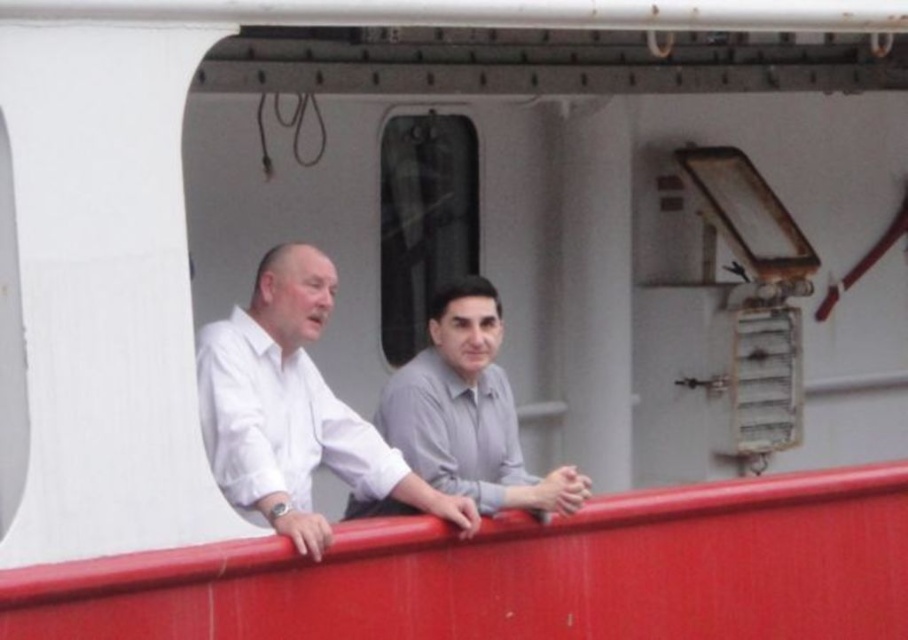
Question: Does smooth glossy red rail at center appear on the left side of gray matte shirt at center?

Choices:
 (A) no
 (B) yes

Answer: (A)

Question: Is smooth glossy red rail at center to the right of gray matte shirt at center from the viewer's perspective?

Choices:
 (A) yes
 (B) no

Answer: (A)

Question: Can you confirm if smooth glossy red rail at center is wider than white matte shirt at center?

Choices:
 (A) yes
 (B) no

Answer: (A)

Question: Which object appears closest to the camera in this image?

Choices:
 (A) white matte shirt at center
 (B) gray matte shirt at center

Answer: (A)

Question: Which point is farther to the camera?

Choices:
 (A) gray matte shirt at center
 (B) white matte shirt at center

Answer: (A)

Question: Which point appears closest to the camera in this image?

Choices:
 (A) (400, 410)
 (B) (316, 460)

Answer: (B)